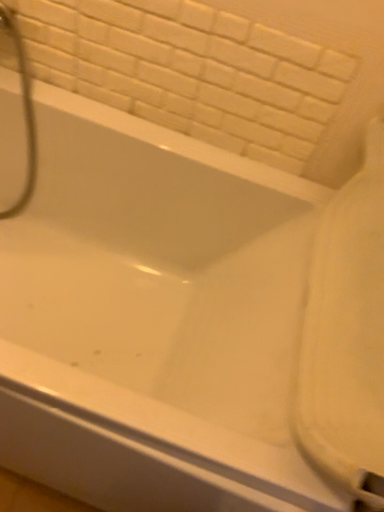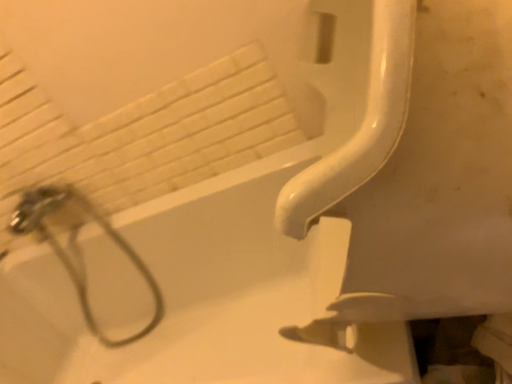
Question: How did the camera likely rotate when shooting the video?

Choices:
 (A) rotated downward
 (B) rotated upward

Answer: (B)